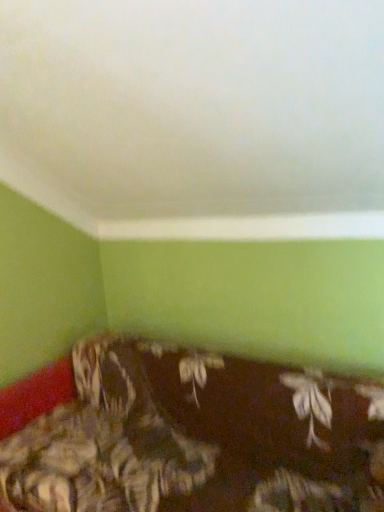
What do you see at coordinates (192, 435) in the screenshot?
I see `floral fabric couch at lower center` at bounding box center [192, 435].

This screenshot has height=512, width=384. I want to click on floral fabric couch at lower center, so click(192, 435).

Where is `floral fabric couch at lower center`? floral fabric couch at lower center is located at coordinates (192, 435).